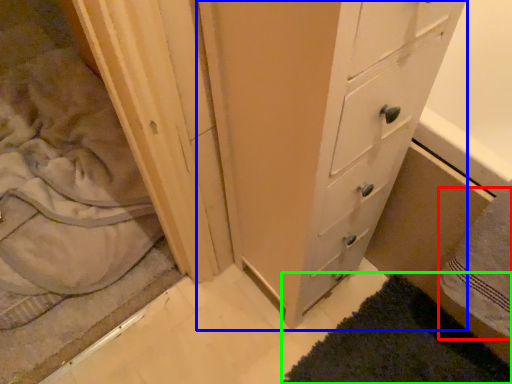
Question: Which object is the farthest from bath towel (highlighted by a red box)? Choose among these: chest of drawers (highlighted by a blue box) or bath mat (highlighted by a green box).

Choices:
 (A) chest of drawers
 (B) bath mat

Answer: (A)